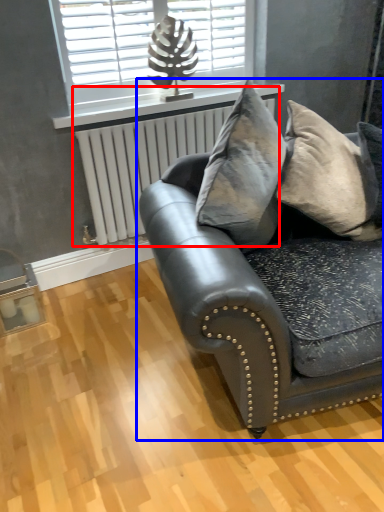
Question: Which point is further to the camera, radiator (highlighted by a red box) or studio couch (highlighted by a blue box)?

Choices:
 (A) radiator
 (B) studio couch

Answer: (A)